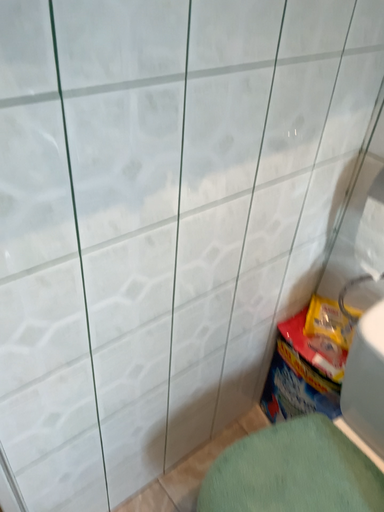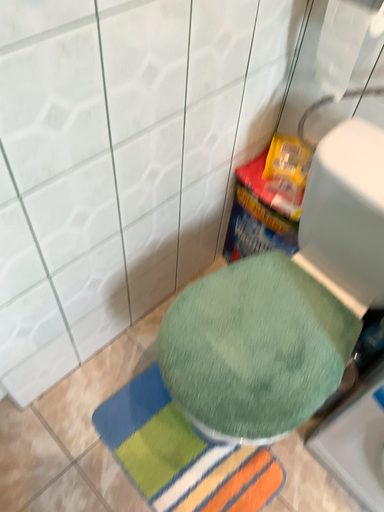
Question: Which way did the camera rotate in the video?

Choices:
 (A) rotated upward
 (B) rotated downward

Answer: (B)